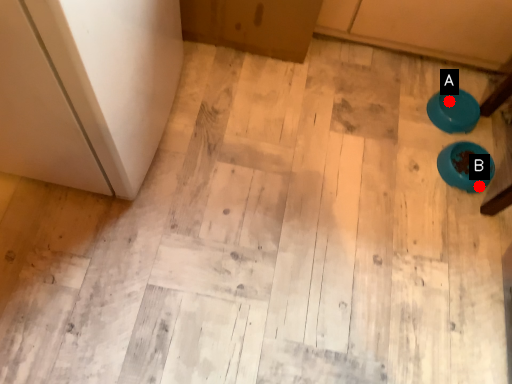
Question: Two points are circled on the image, labeled by A and B beside each circle. Which point appears closest to the camera in this image?

Choices:
 (A) A is closer
 (B) B is closer

Answer: (B)